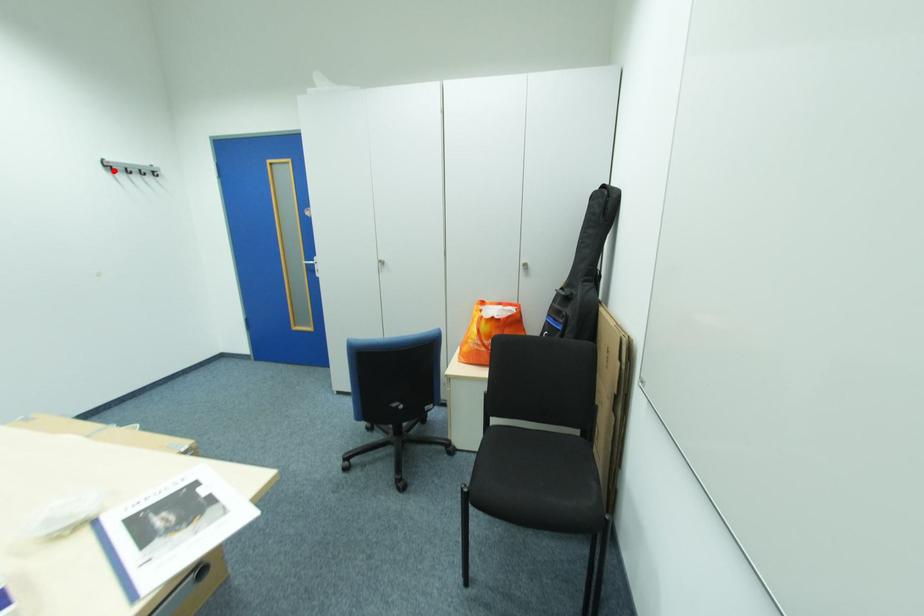
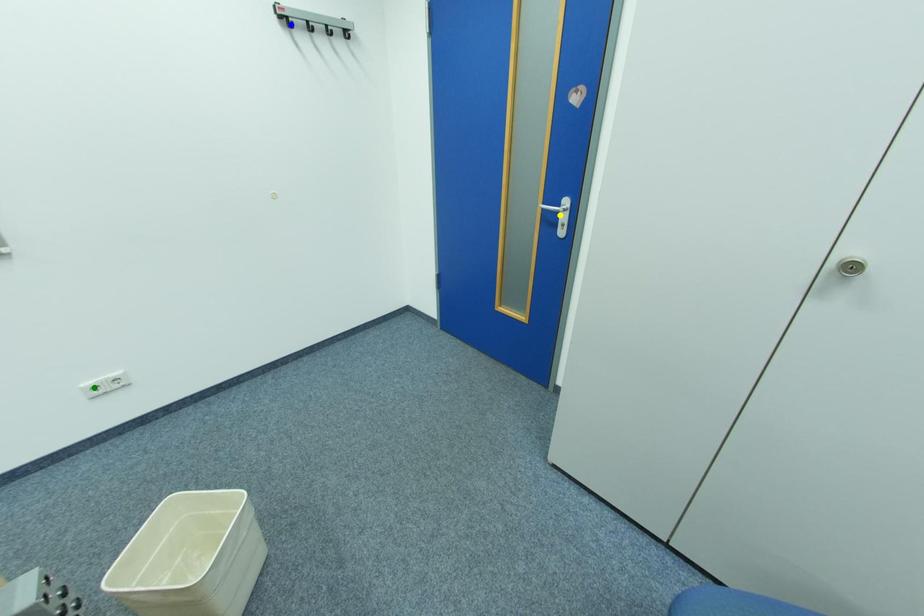
Question: I am providing you with two images of the same scene from different viewpoints. A red point is marked on the first image. You are given multiple points on the second image. Which mark in image 2 goes with the point in image 1?

Choices:
 (A) green point
 (B) blue point
 (C) yellow point

Answer: (B)